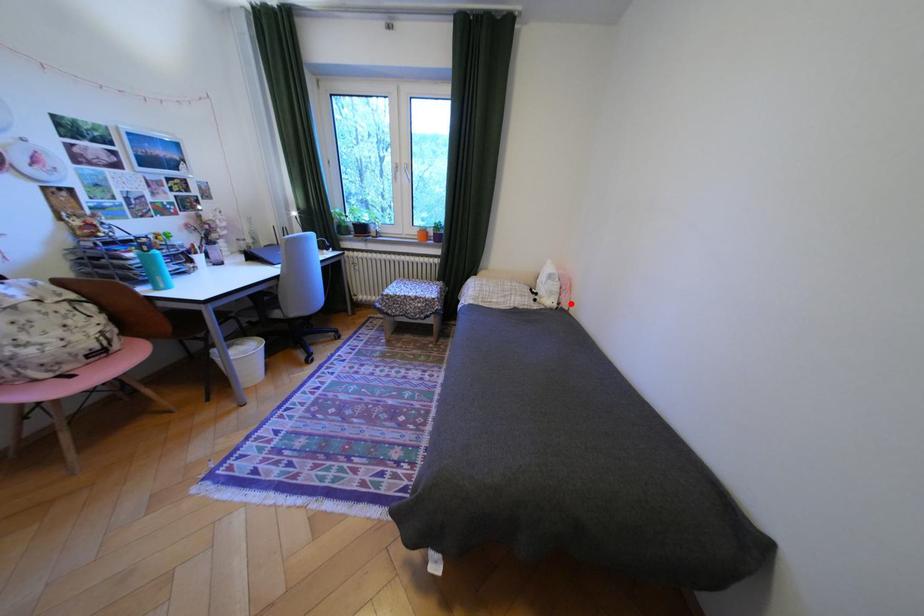
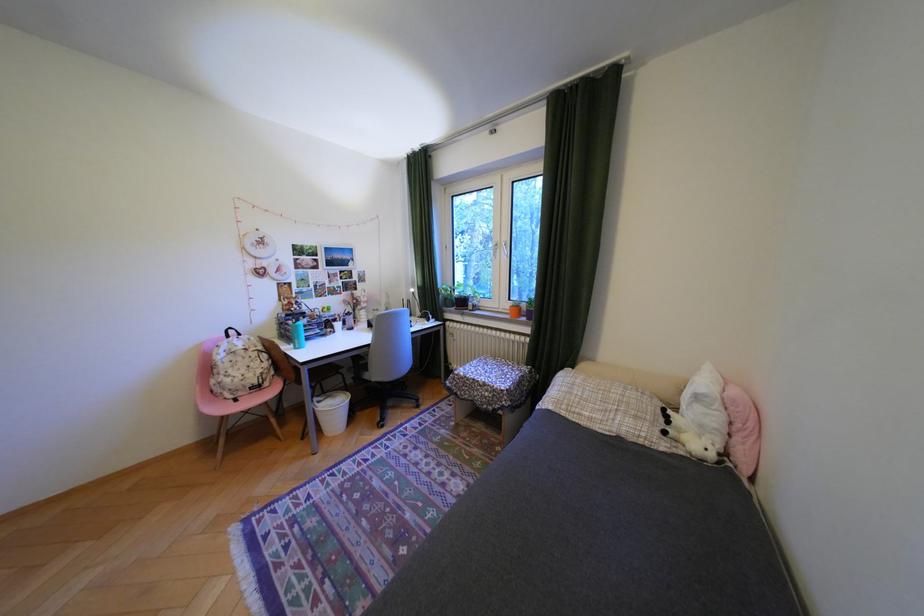
Find the pixel in the second image that matches the highlighted location in the first image.

(736, 455)